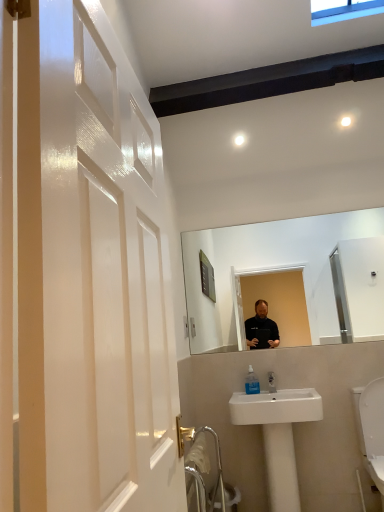
Question: Considering the positions of clear plastic soap dispenser at lower center and white ceramic sink at lower center in the image, is clear plastic soap dispenser at lower center bigger or smaller than white ceramic sink at lower center?

Choices:
 (A) big
 (B) small

Answer: (B)

Question: Is point (258, 382) positioned closer to the camera than point (296, 389)?

Choices:
 (A) farther
 (B) closer

Answer: (A)

Question: Visually, is clear plastic soap dispenser at lower center positioned to the left or to the right of white ceramic sink at lower center?

Choices:
 (A) left
 (B) right

Answer: (A)

Question: Choose the correct answer: Is white ceramic sink at lower center inside clear plastic soap dispenser at lower center or outside it?

Choices:
 (A) outside
 (B) inside

Answer: (A)

Question: From a real-world perspective, is white ceramic sink at lower center above or below clear plastic soap dispenser at lower center?

Choices:
 (A) below
 (B) above

Answer: (A)

Question: Considering the positions of white ceramic sink at lower center and clear plastic soap dispenser at lower center in the image, is white ceramic sink at lower center wider or thinner than clear plastic soap dispenser at lower center?

Choices:
 (A) thin
 (B) wide

Answer: (B)

Question: Considering their positions, is white ceramic sink at lower center located in front of or behind clear plastic soap dispenser at lower center?

Choices:
 (A) front
 (B) behind

Answer: (A)